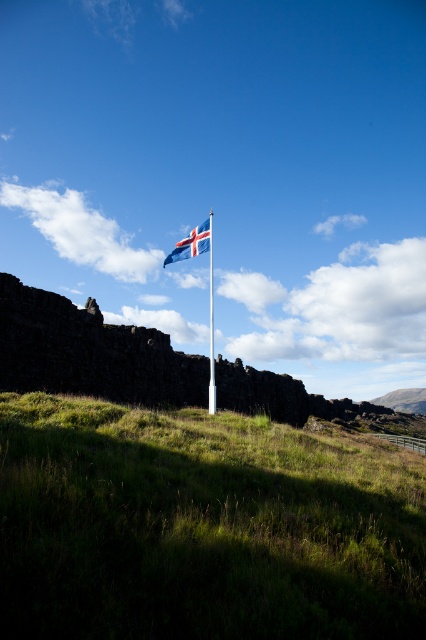
Question: Does blue fabric flag at center come in front of white plastic flag pole at center?

Choices:
 (A) yes
 (B) no

Answer: (B)

Question: Which of the following is the farthest from the observer?

Choices:
 (A) blue fabric flag at center
 (B) green grassy hillside at center
 (C) white plastic flag pole at center

Answer: (A)

Question: Which point is farther from the camera taking this photo?

Choices:
 (A) (368, 458)
 (B) (173, 252)

Answer: (B)

Question: Which of the following is the closest to the observer?

Choices:
 (A) green grassy hillside at center
 (B) white plastic flag pole at center
 (C) blue fabric flag at center

Answer: (A)

Question: Is green grassy hillside at center wider than blue fabric flag at center?

Choices:
 (A) yes
 (B) no

Answer: (B)

Question: Is green grassy hillside at center below blue fabric flag at center?

Choices:
 (A) no
 (B) yes

Answer: (B)